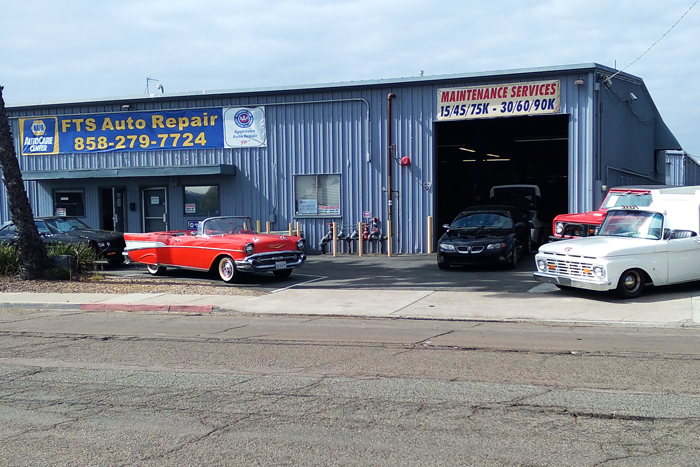
Locate an element on the screen. window is located at coordinates (332, 185), (307, 193).